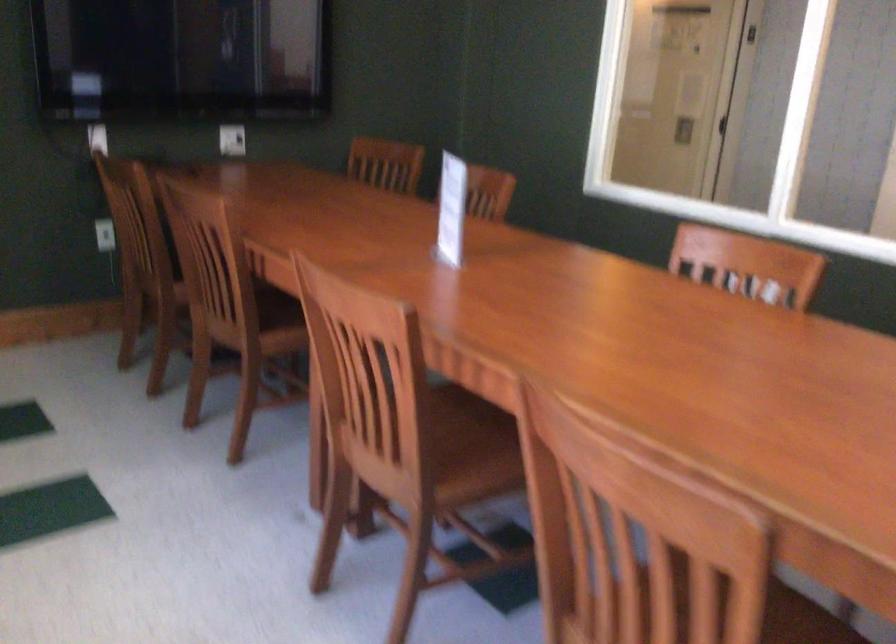
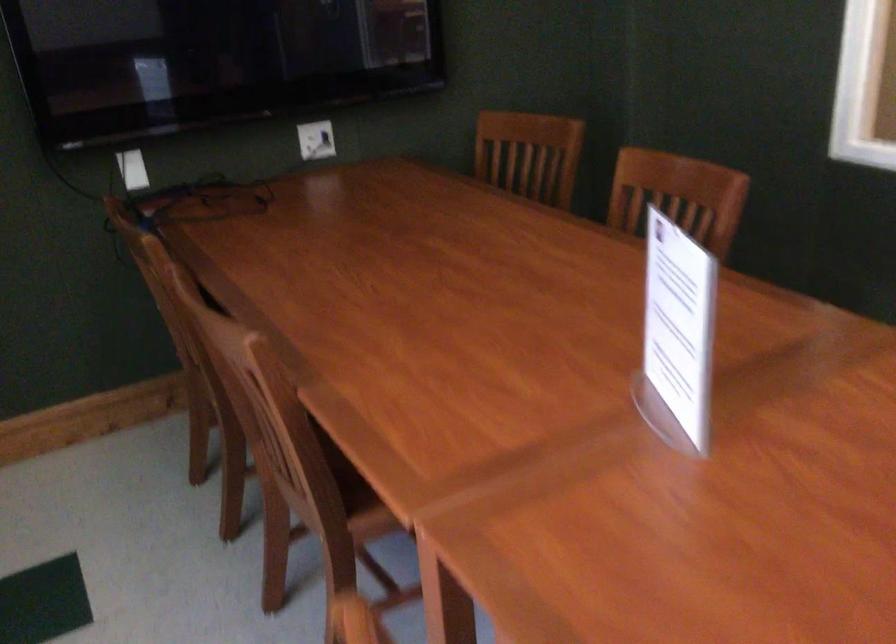
Where in the second image is the point corresponding to pixel 478 187 from the first image?

(677, 196)